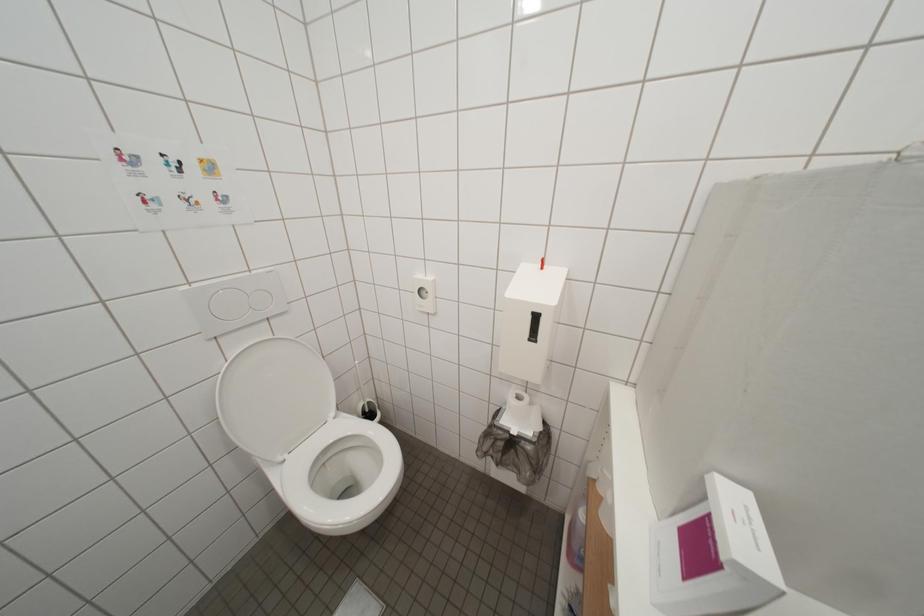
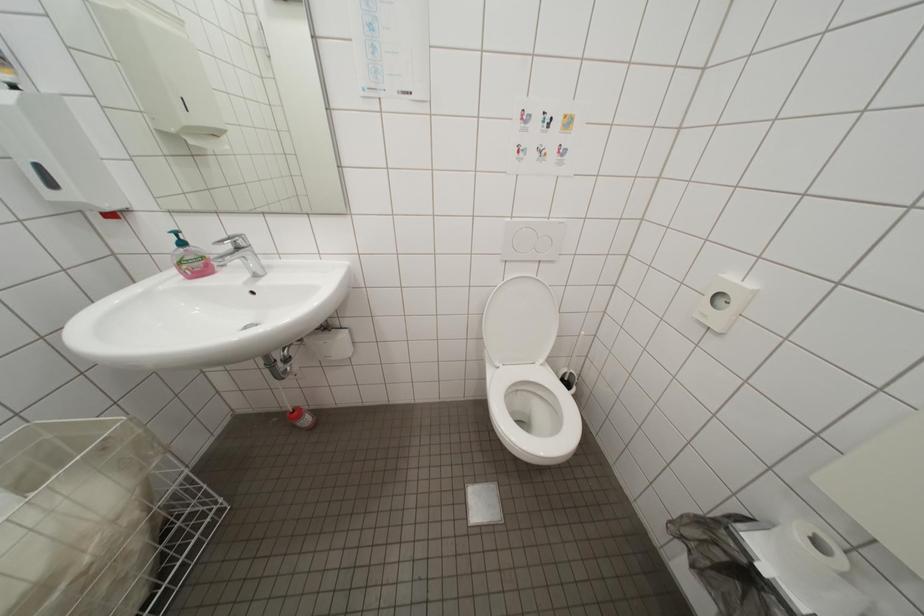
Based on the continuous images, in which direction is the camera rotating?

The rotation direction of the camera is left-down.